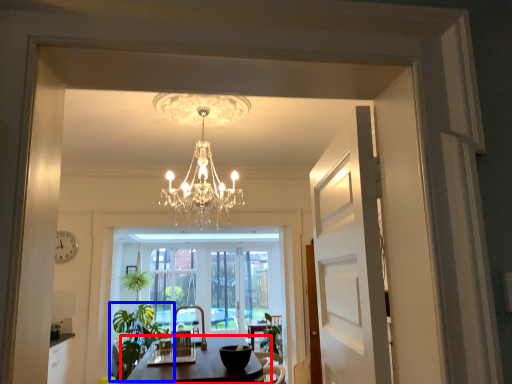
Question: Which object is further to the camera taking this photo, table (highlighted by a red box) or houseplant (highlighted by a blue box)?

Choices:
 (A) table
 (B) houseplant

Answer: (B)